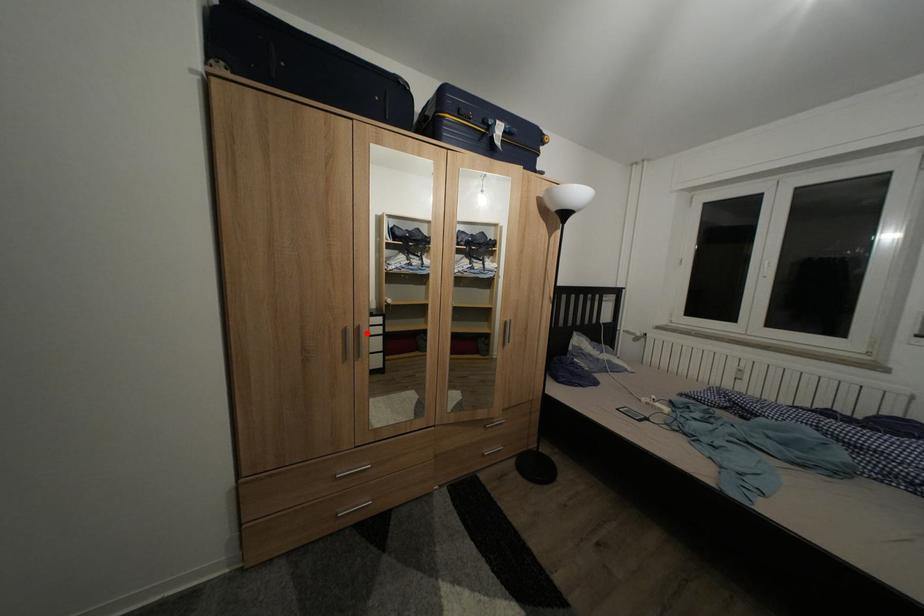
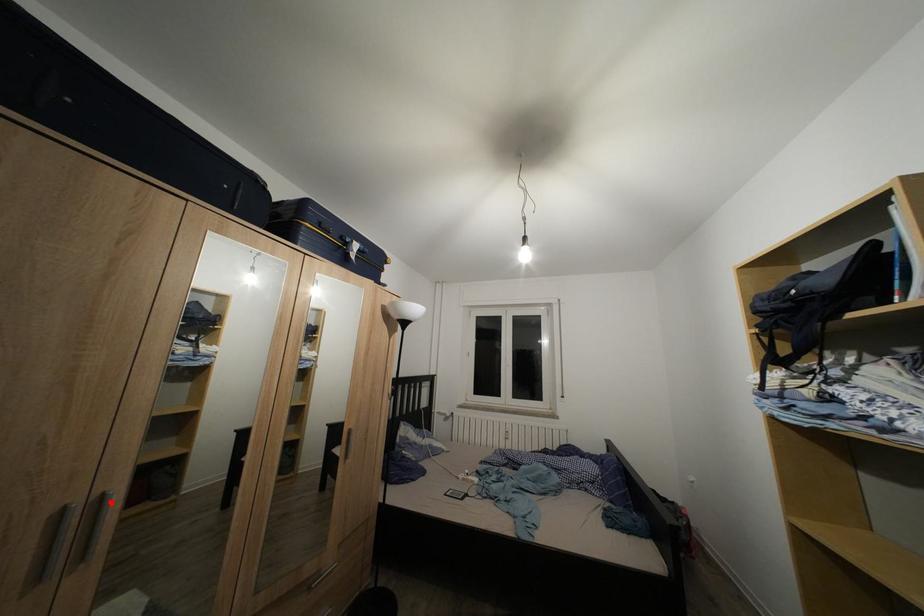
I am providing you with two images of the same scene from different viewpoints. A red point is marked on the first image and another point is marked on the second image. Do the highlighted points in image1 and image2 indicate the same real-world spot?

Yes